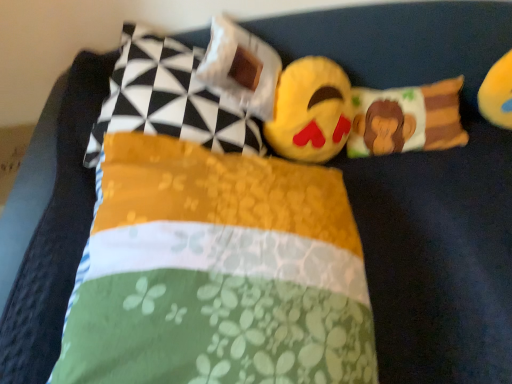
This screenshot has width=512, height=384. Identify the location of empty space that is ontop of yellow fabric pillow at upper left, the fourth pillow in the right-to-left sequence (from a real-world perspective). (174, 55).